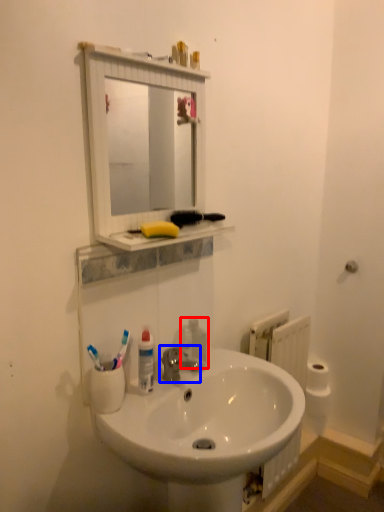
Question: Which object appears farthest to the camera in this image, soap dispenser (highlighted by a red box) or tap (highlighted by a blue box)?

Choices:
 (A) soap dispenser
 (B) tap

Answer: (A)